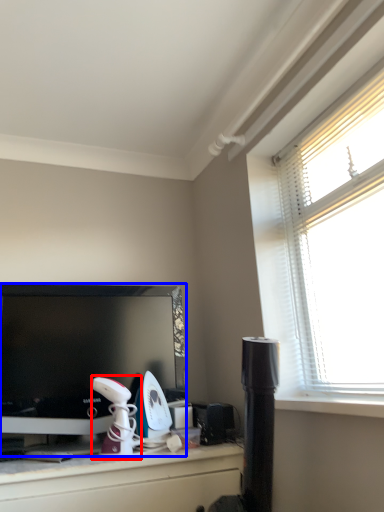
Question: Which point is closer to the camera, appliance (highlighted by a red box) or television (highlighted by a blue box)?

Choices:
 (A) appliance
 (B) television

Answer: (A)